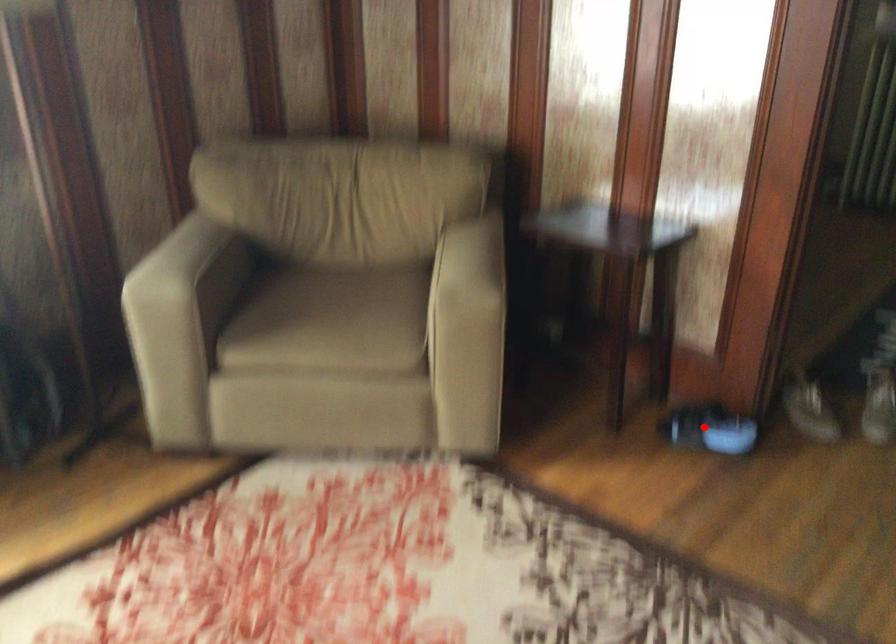
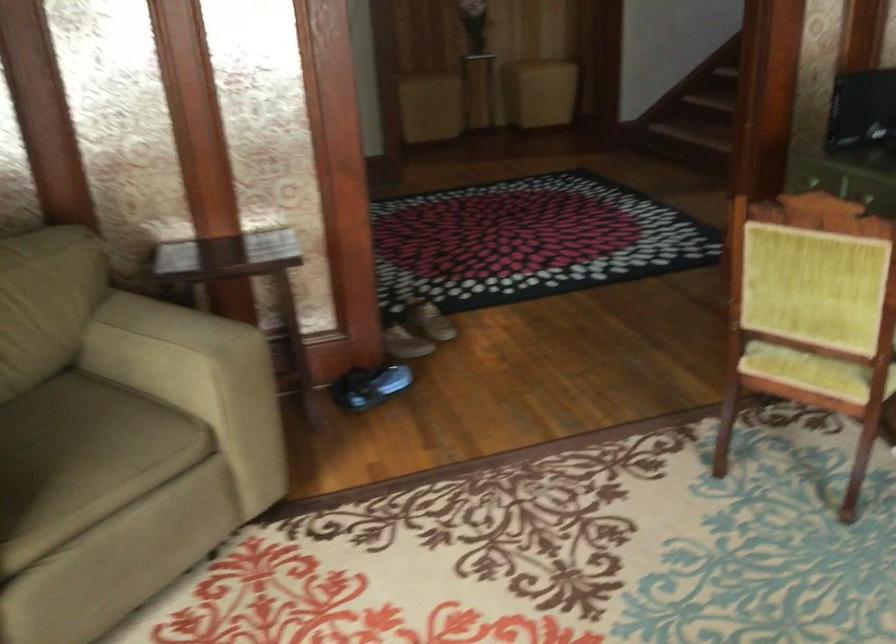
Find the pixel in the second image that matches the highlighted location in the first image.

(369, 386)